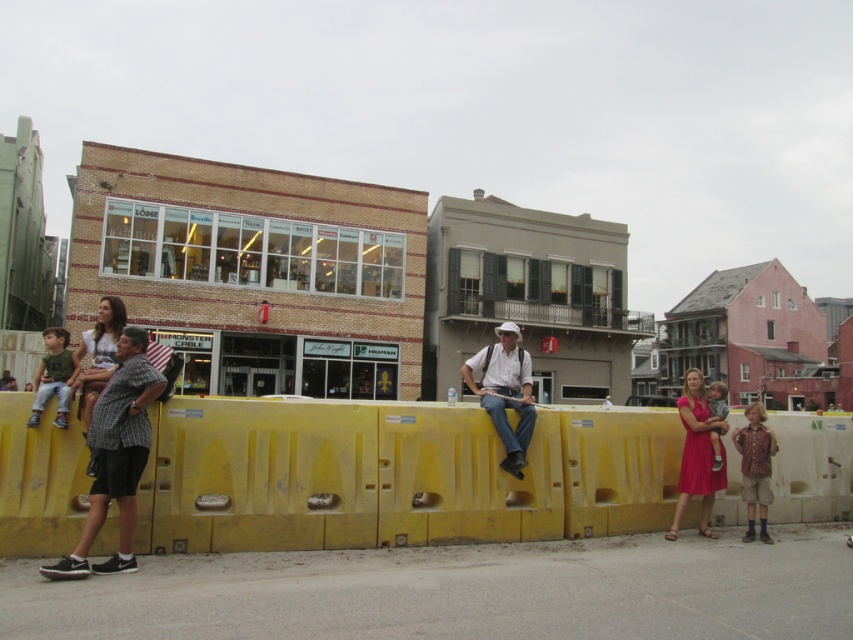
Question: Which point is farther to the camera?

Choices:
 (A) (91, 496)
 (B) (525, 358)

Answer: (B)

Question: Is matte pink dress at center in front of green cotton shirt at left?

Choices:
 (A) yes
 (B) no

Answer: (B)

Question: Can you confirm if checkered fabric shirt at left is positioned above plaid shirt at lower right?

Choices:
 (A) yes
 (B) no

Answer: (A)

Question: Which is nearer to the matte pink dress at center?

Choices:
 (A) light gray cotton shirt at center
 (B) matte white hat at center

Answer: (B)

Question: Does plaid shirt at lower right have a larger size compared to light gray cotton shirt at center?

Choices:
 (A) yes
 (B) no

Answer: (B)

Question: Based on their relative distances, which object is nearer to the checkered fabric shirt at left?

Choices:
 (A) light gray cotton shirt at center
 (B) plaid shirt at lower right

Answer: (B)